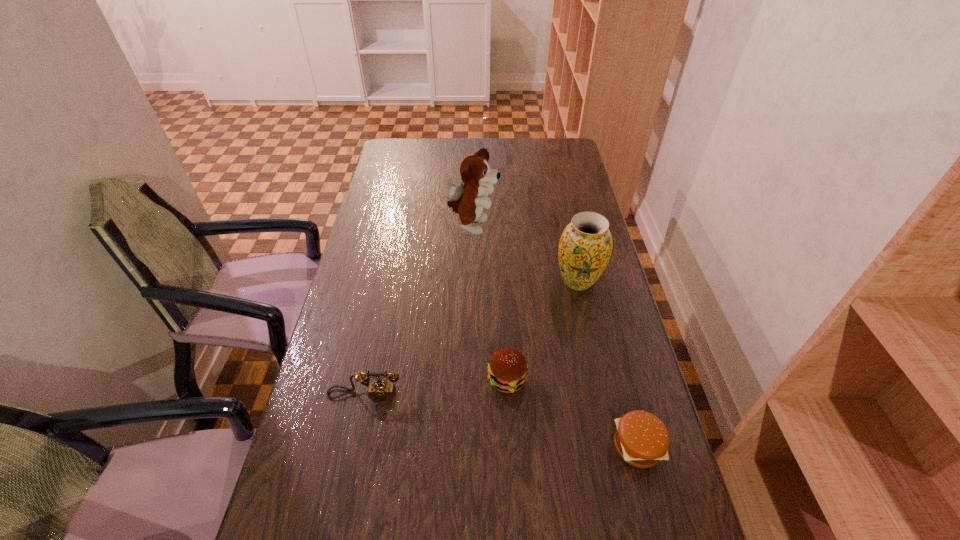
Locate an element on the screen. The image size is (960, 540). free region at the far left corner of the desktop is located at coordinates [402, 156].

This screenshot has height=540, width=960. Identify the location of vacant space at the far right corner of the desktop. (541, 152).

Locate an element on the screen. This screenshot has width=960, height=540. vacant area that lies between the nearer hamburger and the farther hamburger is located at coordinates (572, 413).

You are a GUI agent. You are given a task and a screenshot of the screen. Output one action in this format:
    pyautogui.click(x=<x>, y=<y>)
    Task: Click on the free area in between the taller hamburger and the farthest object
    
    Given the screenshot: What is the action you would take?
    pyautogui.click(x=490, y=303)

This screenshot has height=540, width=960. Find the location of `blank region between the vase and the left hamburger`. blank region between the vase and the left hamburger is located at coordinates (542, 330).

Where is `vacant space in between the shortest object and the left hamburger`? vacant space in between the shortest object and the left hamburger is located at coordinates (x=572, y=413).

Identify the location of vacant area between the vase and the left hamburger. The image size is (960, 540). (542, 330).

The height and width of the screenshot is (540, 960). I want to click on vacant region between the farther hamburger and the leftmost object, so click(x=436, y=387).

Identify the location of free point between the taller hamburger and the farthest object. The image size is (960, 540). (490, 303).

I want to click on free spot between the second tallest object and the tallest object, so click(525, 254).